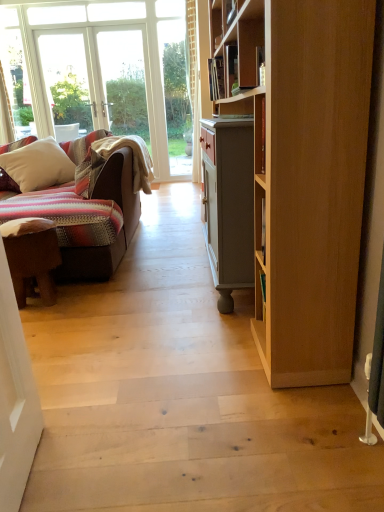
Question: Is white soft pillow at left inside the boundaries of brown leather stool at left, or outside?

Choices:
 (A) inside
 (B) outside

Answer: (B)

Question: Would you say white soft pillow at left is to the left or to the right of brown leather stool at left in the picture?

Choices:
 (A) right
 (B) left

Answer: (B)

Question: Is point (21, 192) positioned closer to the camera than point (44, 285)?

Choices:
 (A) farther
 (B) closer

Answer: (A)

Question: In terms of height, does brown leather stool at left look taller or shorter compared to white soft pillow at left?

Choices:
 (A) tall
 (B) short

Answer: (B)

Question: Considering the positions of brown leather stool at left and white soft pillow at left in the image, is brown leather stool at left bigger or smaller than white soft pillow at left?

Choices:
 (A) small
 (B) big

Answer: (A)

Question: Considering the relative positions of brown leather stool at left and white soft pillow at left in the image provided, is brown leather stool at left to the left or to the right of white soft pillow at left?

Choices:
 (A) left
 (B) right

Answer: (B)

Question: Considering the positions of brown leather stool at left and white soft pillow at left in the image, is brown leather stool at left wider or thinner than white soft pillow at left?

Choices:
 (A) wide
 (B) thin

Answer: (B)